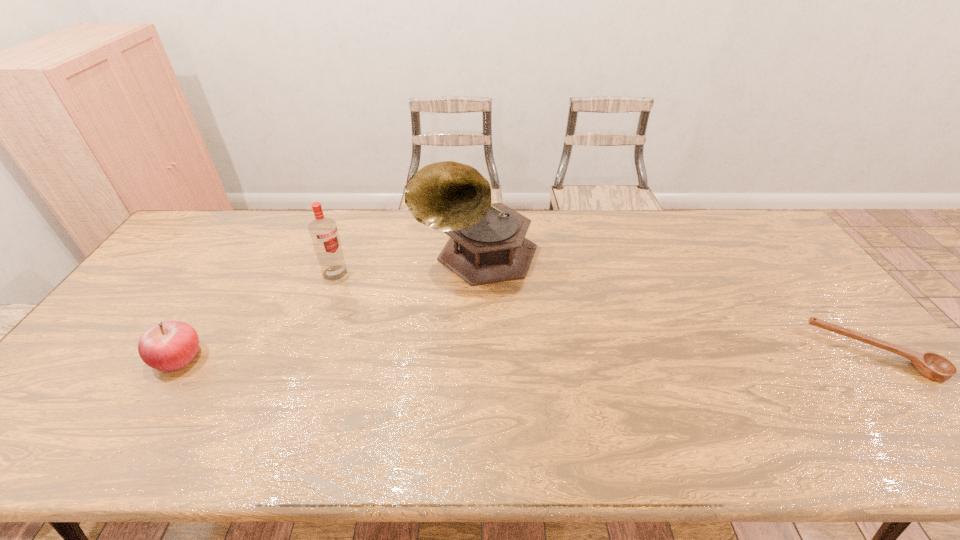
Identify the location of free point between the second object from right to left and the leftmost object. This screenshot has width=960, height=540. (327, 306).

Locate an element on the screen. This screenshot has height=540, width=960. free spot between the shortest object and the tallest object is located at coordinates (675, 304).

Identify the location of vacant space that is in between the shortest object and the second object from right to left. (675, 304).

Where is `free space between the vodka and the third object from left to right`? This screenshot has width=960, height=540. free space between the vodka and the third object from left to right is located at coordinates (406, 264).

You are a GUI agent. You are given a task and a screenshot of the screen. Output one action in this format:
    pyautogui.click(x=<x>, y=<y>)
    Task: Click on the unoccupied position between the tallest object and the apple
    
    Given the screenshot: What is the action you would take?
    pyautogui.click(x=327, y=306)

Identify the location of object that stands as the second closest to the third shortest object. (170, 345).

Locate which object ranks second in proximity to the apple. Please provide its 2D coordinates. Your answer should be formatted as a tuple, i.e. [(x, y)], where the tuple contains the x and y coordinates of a point satisfying the conditions above.

[(487, 244)]

Identify the location of vacant space that satisfies the following two spatial constraints: 1. on the back side of the second object from left to right; 2. on the left side of the tallest object. The height and width of the screenshot is (540, 960). (342, 255).